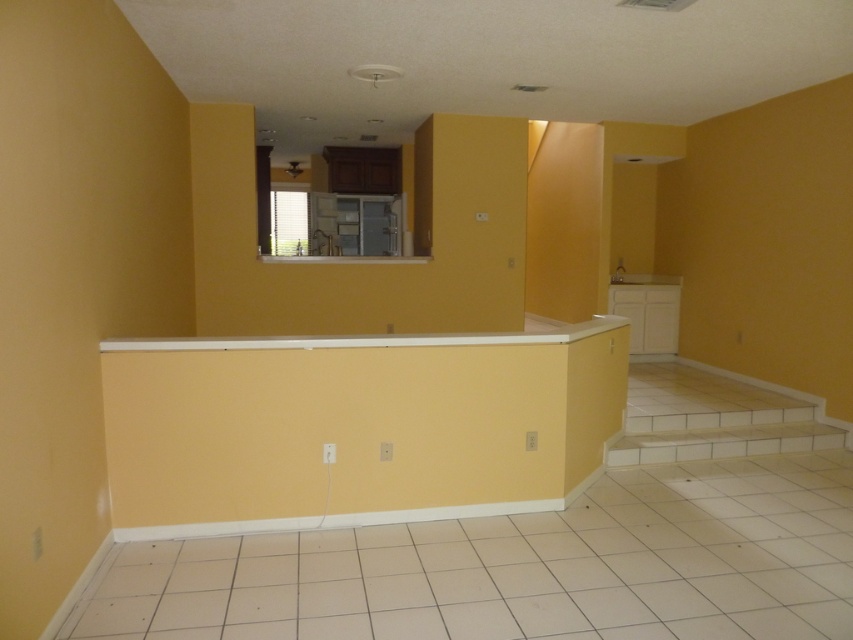
Question: Which point is farther from the camera taking this photo?

Choices:
 (A) (643, 416)
 (B) (235, 477)

Answer: (A)

Question: In this image, where is white smooth trim at center located relative to white tile stairs at lower right?

Choices:
 (A) below
 (B) above

Answer: (B)

Question: Which object is farther from the camera taking this photo?

Choices:
 (A) white smooth trim at center
 (B) white tile stairs at lower right

Answer: (B)

Question: Can you confirm if white smooth trim at center is positioned below white tile stairs at lower right?

Choices:
 (A) no
 (B) yes

Answer: (A)

Question: Which point appears farthest from the camera in this image?

Choices:
 (A) (498, 333)
 (B) (650, 374)

Answer: (B)

Question: Is white smooth trim at center smaller than white tile stairs at lower right?

Choices:
 (A) yes
 (B) no

Answer: (B)